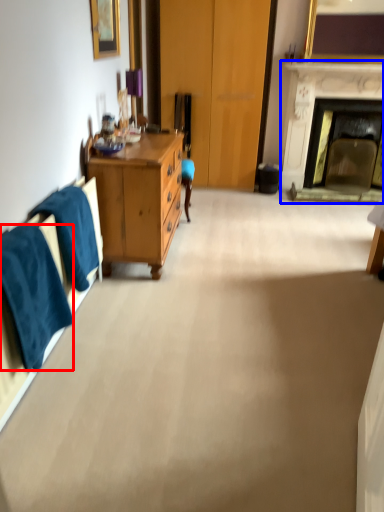
Question: Which object appears farthest to the camera in this image, towel/napkin (highlighted by a red box) or fireplace (highlighted by a blue box)?

Choices:
 (A) towel/napkin
 (B) fireplace

Answer: (B)